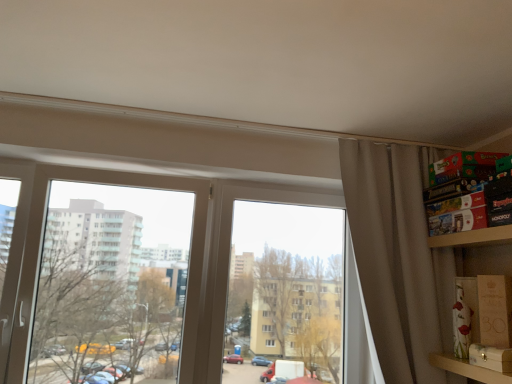
What do you see at coordinates (490, 358) in the screenshot? I see `wooden box at right, the 1th cardboard box when ordered from front to back` at bounding box center [490, 358].

Measure the distance between point (321, 231) and camera.

The depth of point (321, 231) is 9.01 feet.

In order to click on wooden box at right, the 1th cardboard box when ordered from front to back in this screenshot , I will do `click(490, 358)`.

Could you measure the distance between wooden box at right, which is the second cardboard box from back to front, and wooden at right?

6.80 centimeters.

Is wooden box at right, which is the second cardboard box from back to front, next to wooden at right and touching it?

Yes, wooden box at right, which is the second cardboard box from back to front, is next to wooden at right.

Is wooden box at right, which is the second cardboard box from back to front, positioned behind wooden at right?

That is True.

Who is smaller, wooden box at right, the 1th cardboard box when ordered from front to back, or wooden at right?

Smaller between the two is wooden box at right, the 1th cardboard box when ordered from front to back.

Consider the image. Could you tell me if beige fabric curtain at right is facing wooden at right?

Yes, beige fabric curtain at right is aimed at wooden at right.

The image size is (512, 384). What are the coordinates of `curtain behind the wooden at right` in the screenshot? It's located at (393, 257).

Who is shorter, beige fabric curtain at right or wooden at right?

With less height is wooden at right.

Between beige fabric curtain at right and wooden at right, which one has smaller width?

Thinner between the two is beige fabric curtain at right.

From the image's perspective, is transparent glass window at center above or below matte brown cardboard box at lower right, the 1th cardboard box in the back-to-front sequence?

From the image's perspective, transparent glass window at center appears above matte brown cardboard box at lower right, the 1th cardboard box in the back-to-front sequence.

Looking at this image, which point is more distant from viewer, [240,259] or [476,310]?

Point [240,259]

Is transparent glass window at center facing towards matte brown cardboard box at lower right, which is the 2th cardboard box from front to back?

No, transparent glass window at center is not oriented towards matte brown cardboard box at lower right, which is the 2th cardboard box from front to back.

Is matte brown cardboard box at lower right, which is the 2th cardboard box from front to back, far from beige fabric curtain at right?

matte brown cardboard box at lower right, which is the 2th cardboard box from front to back, is actually quite close to beige fabric curtain at right.

In the scene shown: Is matte brown cardboard box at lower right, which is the 2th cardboard box from front to back, not within beige fabric curtain at right?

matte brown cardboard box at lower right, which is the 2th cardboard box from front to back, is positioned outside beige fabric curtain at right.

Looking at this image, how many degrees apart are the facing directions of matte brown cardboard box at lower right, the 1th cardboard box in the back-to-front sequence, and beige fabric curtain at right?

The facing directions of matte brown cardboard box at lower right, the 1th cardboard box in the back-to-front sequence, and beige fabric curtain at right are 52 degrees apart.

Considering the sizes of objects matte brown cardboard box at lower right, which is the 2th cardboard box from front to back, and beige fabric curtain at right in the image provided, who is thinner, matte brown cardboard box at lower right, which is the 2th cardboard box from front to back, or beige fabric curtain at right?

Thinner between the two is matte brown cardboard box at lower right, which is the 2th cardboard box from front to back.

The height and width of the screenshot is (384, 512). I want to click on curtain located on the left of wooden box at right, which is the second cardboard box from back to front, so (x=393, y=257).

Is beige fabric curtain at right oriented away from wooden box at right, the 1th cardboard box when ordered from front to back?

No, beige fabric curtain at right is not facing away from wooden box at right, the 1th cardboard box when ordered from front to back.

Is beige fabric curtain at right next to wooden box at right, which is the second cardboard box from back to front, and touching it?

No.

Would you consider matte brown cardboard box at lower right, which is the 2th cardboard box from front to back, to be distant from wooden at right?

No, there isn't a large distance between matte brown cardboard box at lower right, which is the 2th cardboard box from front to back, and wooden at right.

From a real-world perspective, is matte brown cardboard box at lower right, which is the 2th cardboard box from front to back, located beneath wooden at right?

No, from a real-world perspective, matte brown cardboard box at lower right, which is the 2th cardboard box from front to back, is not beneath wooden at right.

Can you confirm if matte brown cardboard box at lower right, which is the 2th cardboard box from front to back, is taller than wooden at right?

Yes.

Is wooden at right at the back of matte brown cardboard box at lower right, which is the 2th cardboard box from front to back?

No, matte brown cardboard box at lower right, which is the 2th cardboard box from front to back, is not facing away from wooden at right.

From the image's perspective, is wooden box at right, which is the second cardboard box from back to front, on top of matte brown cardboard box at lower right, which is the 2th cardboard box from front to back?

No, from the image's perspective, wooden box at right, which is the second cardboard box from back to front, is not over matte brown cardboard box at lower right, which is the 2th cardboard box from front to back.

Can you confirm if wooden box at right, the 1th cardboard box when ordered from front to back, is bigger than matte brown cardboard box at lower right, the 1th cardboard box in the back-to-front sequence?

Incorrect, wooden box at right, the 1th cardboard box when ordered from front to back, is not larger than matte brown cardboard box at lower right, the 1th cardboard box in the back-to-front sequence.

Find the location of a particular element. Image resolution: width=512 pixels, height=384 pixels. cardboard box below the matte brown cardboard box at lower right, the 1th cardboard box in the back-to-front sequence (from the image's perspective) is located at coordinates (490, 358).

Is wooden box at right, the 1th cardboard box when ordered from front to back, further to the viewer compared to matte brown cardboard box at lower right, which is the 2th cardboard box from front to back?

That is False.

Image resolution: width=512 pixels, height=384 pixels. In order to click on shelf located on the right of wooden box at right, the 1th cardboard box when ordered from front to back in this screenshot , I will do `click(468, 369)`.

This screenshot has height=384, width=512. I want to click on curtain lying on the left of wooden at right, so click(393, 257).

Looking at the image, which one is located further to beige fabric curtain at right, matte brown cardboard box at lower right, which is the 2th cardboard box from front to back, or wooden at right?

wooden at right lies further to beige fabric curtain at right than the other object.

When comparing their distances from wooden box at right, which is the second cardboard box from back to front, does beige fabric curtain at right or wooden at right seem closer?

wooden at right is closer to wooden box at right, which is the second cardboard box from back to front.

Considering their positions, is beige fabric curtain at right positioned further to wooden box at right, the 1th cardboard box when ordered from front to back, than transparent glass window at center?

Among the two, transparent glass window at center is located further to wooden box at right, the 1th cardboard box when ordered from front to back.

Based on their spatial positions, is wooden at right or wooden box at right, the 1th cardboard box when ordered from front to back, closer to beige fabric curtain at right?

Among the two, wooden at right is located nearer to beige fabric curtain at right.

When comparing their distances from transparent glass window at center, does beige fabric curtain at right or wooden box at right, which is the second cardboard box from back to front, seem closer?

beige fabric curtain at right is positioned closer to the anchor transparent glass window at center.

Looking at this image, when comparing their distances from matte brown cardboard box at lower right, which is the 2th cardboard box from front to back, does transparent glass window at left or beige fabric curtain at right seem closer?

The object closer to matte brown cardboard box at lower right, which is the 2th cardboard box from front to back, is beige fabric curtain at right.

Looking at this image, looking at the image, which one is located closer to wooden at right, transparent glass window at center or matte brown cardboard box at lower right, the 1th cardboard box in the back-to-front sequence?

Among the two, matte brown cardboard box at lower right, the 1th cardboard box in the back-to-front sequence, is located nearer to wooden at right.

Looking at the image, which one is located closer to wooden box at right, which is the second cardboard box from back to front, transparent glass window at center or matte brown cardboard box at lower right, the 1th cardboard box in the back-to-front sequence?

matte brown cardboard box at lower right, the 1th cardboard box in the back-to-front sequence, is closer to wooden box at right, which is the second cardboard box from back to front.

This screenshot has width=512, height=384. Identify the location of cardboard box between transparent glass window at center and wooden at right in the horizontal direction. (490, 358).

Find the location of a particular element. The width and height of the screenshot is (512, 384). window screen situated between transparent glass window at left and wooden at right from left to right is located at coordinates (285, 289).

This screenshot has width=512, height=384. What are the coordinates of `window screen located between transparent glass window at left and matte brown cardboard box at lower right, which is the 2th cardboard box from front to back, in the left-right direction` in the screenshot? It's located at (285, 289).

Locate an element on the screen. The height and width of the screenshot is (384, 512). shelf between transparent glass window at center and matte brown cardboard box at lower right, which is the 2th cardboard box from front to back, from left to right is located at coordinates (468, 369).